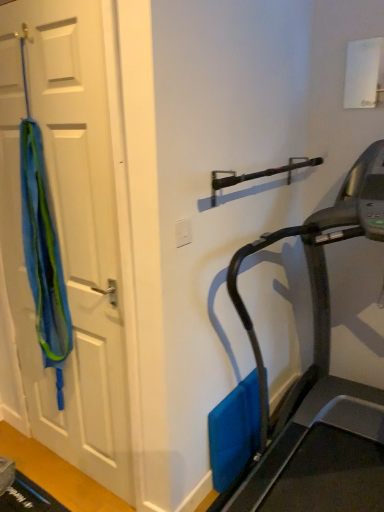
Question: Is blue fabric at left turned away from blue fabric at left?

Choices:
 (A) yes
 (B) no

Answer: (A)

Question: Is blue fabric at left bigger than blue fabric at left?

Choices:
 (A) no
 (B) yes

Answer: (B)

Question: Is blue fabric at left oriented towards blue fabric at left?

Choices:
 (A) yes
 (B) no

Answer: (A)

Question: From a real-world perspective, is blue fabric at left below blue fabric at left?

Choices:
 (A) yes
 (B) no

Answer: (A)

Question: Is blue fabric at left positioned before blue fabric at left?

Choices:
 (A) yes
 (B) no

Answer: (A)

Question: Is black metallic door handle at upper center to the left or to the right of blue fabric at left in the image?

Choices:
 (A) left
 (B) right

Answer: (B)

Question: Is black metallic door handle at upper center wider or thinner than blue fabric at left?

Choices:
 (A) thin
 (B) wide

Answer: (B)

Question: From the image's perspective, is black metallic door handle at upper center above or below blue fabric at left?

Choices:
 (A) above
 (B) below

Answer: (A)

Question: Is point (276, 167) closer or farther from the camera than point (66, 330)?

Choices:
 (A) closer
 (B) farther

Answer: (B)

Question: From a real-world perspective, relative to blue fabric at left, is blue fabric at left vertically above or below?

Choices:
 (A) above
 (B) below

Answer: (A)

Question: Looking at their shapes, would you say blue fabric at left is wider or thinner than blue fabric at left?

Choices:
 (A) thin
 (B) wide

Answer: (B)

Question: Looking at the image, does blue fabric at left seem bigger or smaller compared to blue fabric at left?

Choices:
 (A) big
 (B) small

Answer: (B)

Question: From the image's perspective, relative to blue fabric at left, is blue fabric at left above or below?

Choices:
 (A) below
 (B) above

Answer: (B)

Question: Is white plastic electric outlet at center inside the boundaries of blue fabric at left, or outside?

Choices:
 (A) inside
 (B) outside

Answer: (B)

Question: Considering the positions of white plastic electric outlet at center and blue fabric at left in the image, is white plastic electric outlet at center wider or thinner than blue fabric at left?

Choices:
 (A) thin
 (B) wide

Answer: (A)